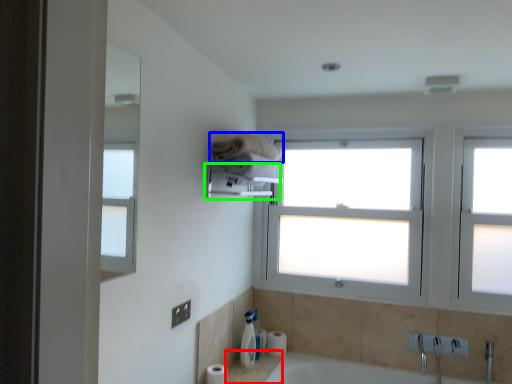
Question: Estimate the real-world distances between objects in this image. Which object is farther from counter top (highlighted by a red box), towel (highlighted by a blue box) or towel bar (highlighted by a green box)?

Choices:
 (A) towel
 (B) towel bar

Answer: (A)